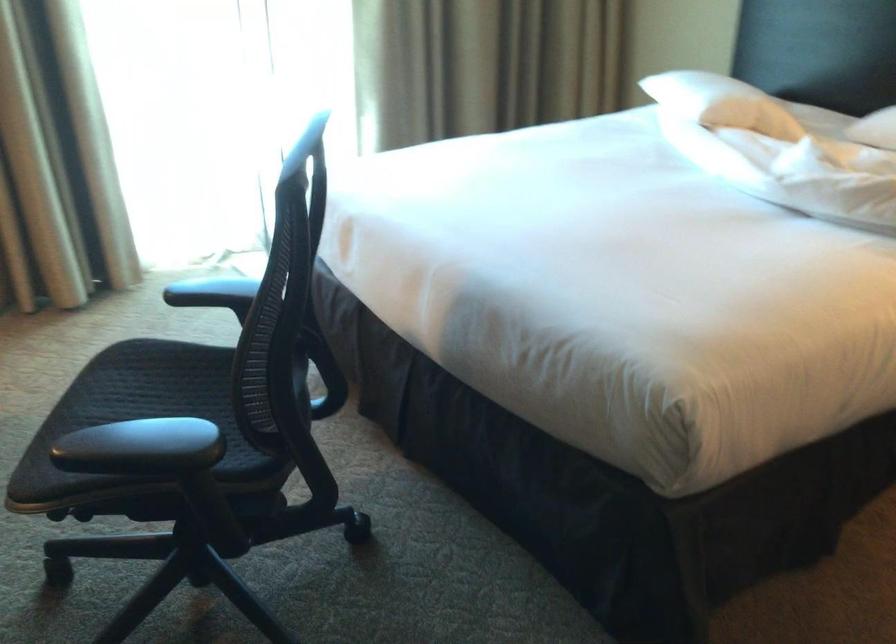
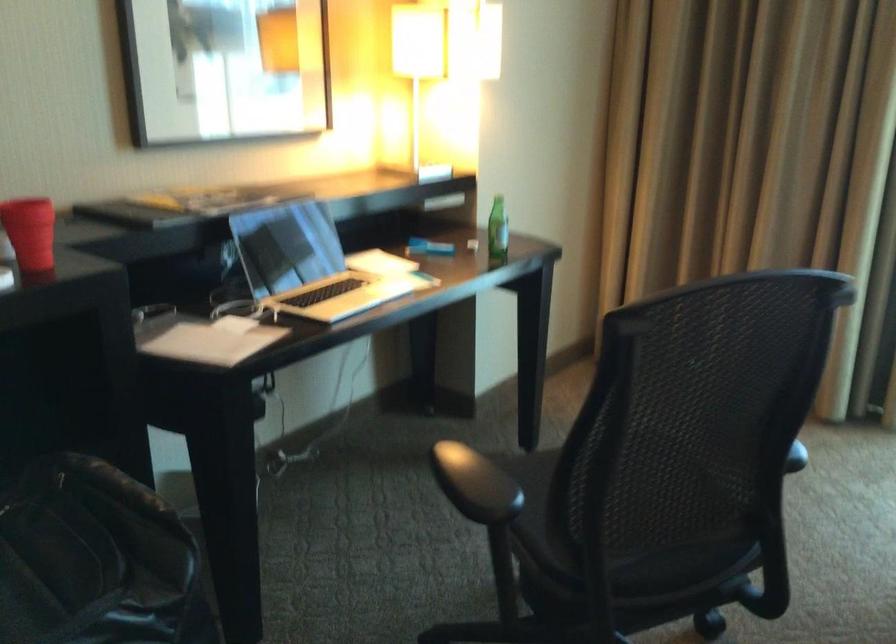
Question: I am providing you with two images of the same scene from different viewpoints. Which of the following objects are not visible in image2?

Choices:
 (A) chair sitting surface
 (B) laptop display
 (C) pen holder cup
 (D) red plastic cup

Answer: (A)